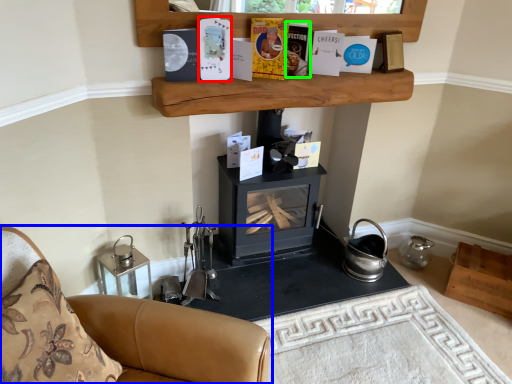
Question: Which object is positioned closest to paperback book (highlighted by a red box)? Select from furniture (highlighted by a blue box) and paperback book (highlighted by a green box).

Choices:
 (A) furniture
 (B) paperback book

Answer: (B)